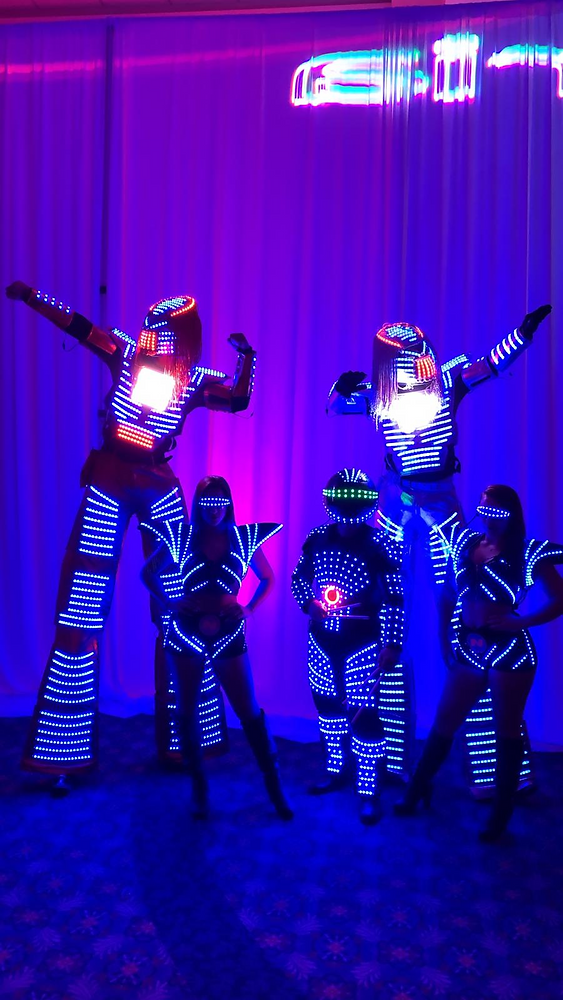
Locate an element on the screen. Image resolution: width=563 pixels, height=1000 pixels. curtains is located at coordinates (406, 198).